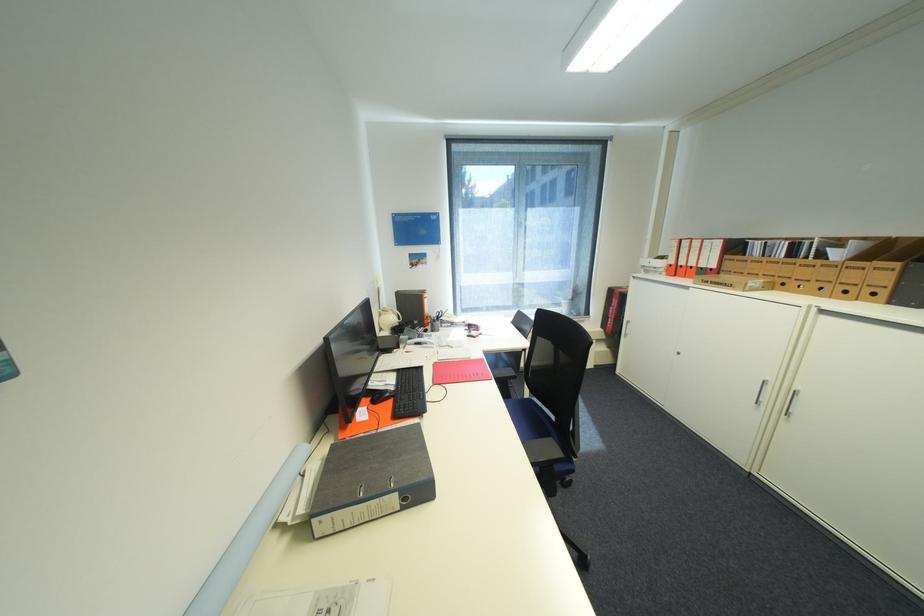
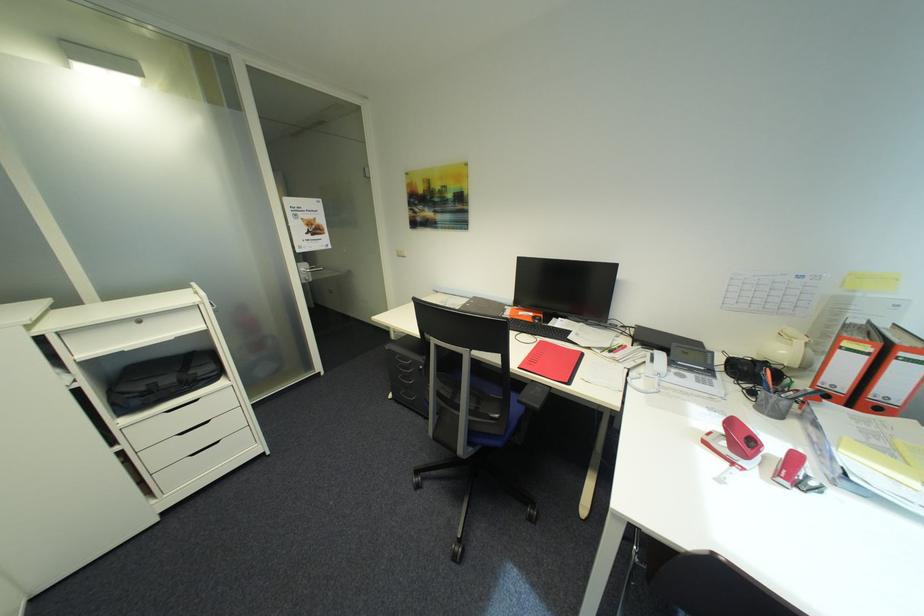
Where in the second image is the point corresponding to point (489, 334) from the first image?

(742, 464)